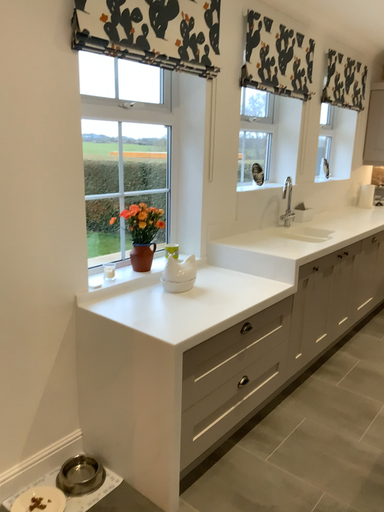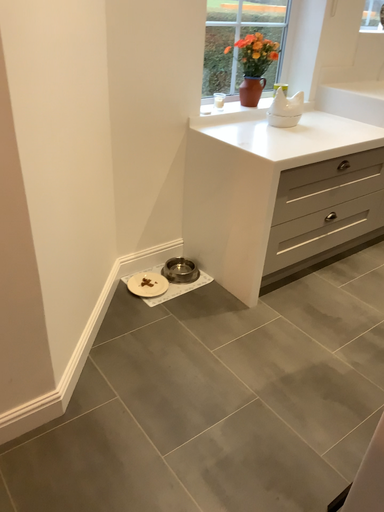
Question: Which way did the camera rotate in the video?

Choices:
 (A) rotated left
 (B) rotated right

Answer: (A)